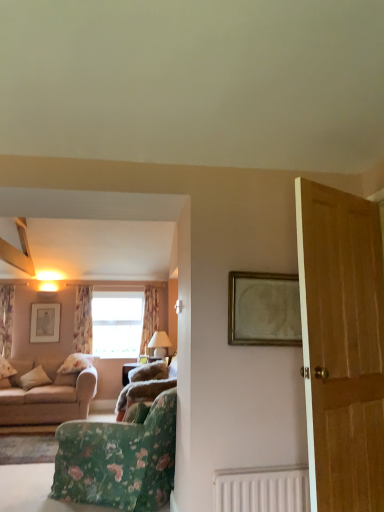
The image size is (384, 512). Describe the element at coordinates (159, 344) in the screenshot. I see `matte white lampshade at center` at that location.

Where is `beige fabric couch at left, which is the 1th studio couch in left-to-right order`? beige fabric couch at left, which is the 1th studio couch in left-to-right order is located at coordinates (50, 399).

This screenshot has height=512, width=384. Identify the location of fluffy beige couch at center, which is counted as the second studio couch, starting from the left. (146, 389).

This screenshot has height=512, width=384. What are the coordinates of `light brown wooden door at right` in the screenshot? It's located at (342, 346).

The height and width of the screenshot is (512, 384). I want to click on matte white lampshade at center, so click(159, 344).

Is matte white lampshade at center positioned far away from white matte radiator at lower center?

matte white lampshade at center is positioned a significant distance from white matte radiator at lower center.

From a real-world perspective, relative to white matte radiator at lower center, is matte white lampshade at center vertically above or below?

matte white lampshade at center is above white matte radiator at lower center.

Based on the photo, would you say matte white lampshade at center is inside or outside white matte radiator at lower center?

matte white lampshade at center cannot be found inside white matte radiator at lower center.

From the picture: Which of these two, matte white lampshade at center or white matte radiator at lower center, stands taller?

matte white lampshade at center is taller.

You are a GUI agent. You are given a task and a screenshot of the screen. Output one action in this format:
    pyautogui.click(x=<x>, y=<y>)
    Task: Click on the 2nd studio couch directly beneath the matte white lampshade at center (from a real-world perspective)
    
    Given the screenshot: What is the action you would take?
    coord(50,399)

Which object is thinner, beige fabric couch at left, which is the 1th studio couch in left-to-right order, or matte white lampshade at center?

Thinner between the two is matte white lampshade at center.

Considering the relative sizes of beige fabric couch at left, marked as the second studio couch in a right-to-left arrangement, and matte white lampshade at center in the image provided, is beige fabric couch at left, marked as the second studio couch in a right-to-left arrangement, taller than matte white lampshade at center?

Correct, beige fabric couch at left, marked as the second studio couch in a right-to-left arrangement, is much taller as matte white lampshade at center.

From the image's perspective, is beige fabric couch at left, which is the 1th studio couch in left-to-right order, located above or below matte white lampshade at center?

Based on their image positions, beige fabric couch at left, which is the 1th studio couch in left-to-right order, is located beneath matte white lampshade at center.

Which is closer, (156, 311) or (30, 417)?

Point (156, 311) appears to be farther away from the viewer than point (30, 417).

Does floral fabric curtain at center, the 1th curtain positioned from the right, have a smaller size compared to beige fabric couch at left, which is the 1th studio couch in left-to-right order?

Indeed, floral fabric curtain at center, the 1th curtain positioned from the right, has a smaller size compared to beige fabric couch at left, which is the 1th studio couch in left-to-right order.

Considering the sizes of floral fabric curtain at center, the 1th curtain positioned from the right, and beige fabric couch at left, marked as the second studio couch in a right-to-left arrangement, in the image, is floral fabric curtain at center, the 1th curtain positioned from the right, taller or shorter than beige fabric couch at left, marked as the second studio couch in a right-to-left arrangement,?

Clearly, floral fabric curtain at center, the 1th curtain positioned from the right, is taller compared to beige fabric couch at left, marked as the second studio couch in a right-to-left arrangement.

Is floral fabric curtain at center, the 1th curtain positioned from the right, positioned in front of beige fabric couch at left, which is the 1th studio couch in left-to-right order?

No, the depth of floral fabric curtain at center, the 1th curtain positioned from the right, is greater than that of beige fabric couch at left, which is the 1th studio couch in left-to-right order.

Which of these two, floral fabric curtain at left, the second curtain when ordered from left to right, or gold-toned wooden frame at upper center, arranged as the 1th picture frame when viewed from the front, is wider?

floral fabric curtain at left, the second curtain when ordered from left to right, is wider.

Which is more to the right, floral fabric curtain at left, positioned as the 2th curtain in right-to-left order, or gold-toned wooden frame at upper center, the 2th picture frame viewed from the back?

Positioned to the right is gold-toned wooden frame at upper center, the 2th picture frame viewed from the back.

From the image's perspective, between floral fabric curtain at left, positioned as the 2th curtain in right-to-left order, and gold-toned wooden frame at upper center, arranged as the 1th picture frame when viewed from the front, which one is located above?

gold-toned wooden frame at upper center, arranged as the 1th picture frame when viewed from the front.

From a real-world perspective, which object rests below the other?

From a 3D spatial view, gold-toned wooden frame at upper center, the 2th picture frame viewed from the back, is below.

Is floral fabric curtain at center, the 3th curtain viewed from the left, directly adjacent to matte white lampshade at center?

floral fabric curtain at center, the 3th curtain viewed from the left, and matte white lampshade at center are not in contact.

Considering the relative sizes of floral fabric curtain at center, the 3th curtain viewed from the left, and matte white lampshade at center in the image provided, is floral fabric curtain at center, the 3th curtain viewed from the left, shorter than matte white lampshade at center?

Incorrect, the height of floral fabric curtain at center, the 3th curtain viewed from the left, does not fall short of that of matte white lampshade at center.

How different are the orientations of floral fabric curtain at center, the 3th curtain viewed from the left, and matte white lampshade at center in degrees?

The angle between the facing direction of floral fabric curtain at center, the 3th curtain viewed from the left, and the facing direction of matte white lampshade at center is 91.5 degrees.

Which is behind, floral fabric curtain at center, the 1th curtain positioned from the right, or matte white lampshade at center?

floral fabric curtain at center, the 1th curtain positioned from the right, is further from the camera.

How many degrees apart are the facing directions of floral fabric chair at lower left and matte silver picture frame at upper left, placed as the second picture frame when sorted from right to left?

They differ by 0.11 degrees in their facing directions.

Could you tell me if floral fabric chair at lower left is facing matte silver picture frame at upper left, placed as the second picture frame when sorted from right to left?

No, floral fabric chair at lower left is not turned towards matte silver picture frame at upper left, placed as the second picture frame when sorted from right to left.

Who is taller, floral fabric chair at lower left or matte silver picture frame at upper left, placed as the second picture frame when sorted from right to left?

matte silver picture frame at upper left, placed as the second picture frame when sorted from right to left.

Is floral fabric chair at lower left at the left side of matte silver picture frame at upper left, placed as the 1th picture frame when sorted from left to right?

No, floral fabric chair at lower left is not to the left of matte silver picture frame at upper left, placed as the 1th picture frame when sorted from left to right.

Is floral fabric curtain at left, the second curtain when ordered from left to right, completely or partially inside floral fabric chair at lower left?

No.

Is floral fabric chair at lower left positioned far away from floral fabric curtain at left, the second curtain when ordered from left to right?

Yes, floral fabric chair at lower left is far from floral fabric curtain at left, the second curtain when ordered from left to right.

Considering the relative sizes of floral fabric chair at lower left and floral fabric curtain at left, positioned as the 2th curtain in right-to-left order, in the image provided, is floral fabric chair at lower left wider than floral fabric curtain at left, positioned as the 2th curtain in right-to-left order,?

Correct, the width of floral fabric chair at lower left exceeds that of floral fabric curtain at left, positioned as the 2th curtain in right-to-left order.

Is floral fabric chair at lower left at the right side of floral fabric curtain at left, positioned as the 2th curtain in right-to-left order?

Indeed, floral fabric chair at lower left is positioned on the right side of floral fabric curtain at left, positioned as the 2th curtain in right-to-left order.

Locate an element on the screen. The height and width of the screenshot is (512, 384). lamp behind the white matte radiator at lower center is located at coordinates (159, 344).

Where is `the 2nd studio couch in front of the matte white lampshade at center`? the 2nd studio couch in front of the matte white lampshade at center is located at coordinates (50, 399).

Considering their positions, is white matte radiator at lower center positioned further to light brown wooden door at right than floral fabric curtain at left, positioned as the 2th curtain in right-to-left order?

floral fabric curtain at left, positioned as the 2th curtain in right-to-left order, is positioned further to the anchor light brown wooden door at right.

When comparing their distances from fluffy beige couch at center, the first studio couch positioned from the right, does beige fabric couch at left, marked as the second studio couch in a right-to-left arrangement, or floral fabric curtain at left, marked as the third curtain in a right-to-left arrangement, seem further?

The object further to fluffy beige couch at center, the first studio couch positioned from the right, is floral fabric curtain at left, marked as the third curtain in a right-to-left arrangement.

From the image, which object appears to be farther from fluffy beige couch at center, which is counted as the second studio couch, starting from the left, floral fabric curtain at left, marked as the third curtain in a right-to-left arrangement, or matte white lampshade at center?

floral fabric curtain at left, marked as the third curtain in a right-to-left arrangement.

From the image, which object appears to be farther from floral fabric curtain at left, marked as the third curtain in a right-to-left arrangement, floral fabric chair at lower left or matte white lampshade at center?

floral fabric chair at lower left is positioned further to the anchor floral fabric curtain at left, marked as the third curtain in a right-to-left arrangement.

Estimate the real-world distances between objects in this image. Which object is closer to beige fabric couch at left, marked as the second studio couch in a right-to-left arrangement, floral fabric curtain at center, the 3th curtain viewed from the left, or white matte radiator at lower center?

The object closer to beige fabric couch at left, marked as the second studio couch in a right-to-left arrangement, is floral fabric curtain at center, the 3th curtain viewed from the left.

Which object lies nearer to the anchor point fluffy beige couch at center, which is counted as the second studio couch, starting from the left, floral fabric curtain at center, the 1th curtain positioned from the right, or white matte radiator at lower center?

white matte radiator at lower center is positioned closer to the anchor fluffy beige couch at center, which is counted as the second studio couch, starting from the left.

Estimate the real-world distances between objects in this image. Which object is further from matte white lampshade at center, white matte radiator at lower center or fluffy beige couch at center, the first studio couch positioned from the right?

The object further to matte white lampshade at center is white matte radiator at lower center.

Looking at the image, which one is located closer to floral fabric curtain at left, the second curtain when ordered from left to right, floral fabric curtain at center, the 1th curtain positioned from the right, or beige fabric couch at left, marked as the second studio couch in a right-to-left arrangement?

floral fabric curtain at center, the 1th curtain positioned from the right.

The image size is (384, 512). What are the coordinates of `picture frame positioned between white matte radiator at lower center and beige fabric couch at left, which is the 1th studio couch in left-to-right order, from near to far` in the screenshot? It's located at (264, 309).

Locate an element on the screen. chair between white matte radiator at lower center and matte silver picture frame at upper left, placed as the second picture frame when sorted from right to left, in the front-back direction is located at coordinates (119, 460).

What are the coordinates of `studio couch between floral fabric chair at lower left and fluffy beige couch at center, which is counted as the second studio couch, starting from the left, from front to back` in the screenshot? It's located at (50, 399).

This screenshot has height=512, width=384. Find the location of `picture frame between floral fabric chair at lower left and matte silver picture frame at upper left, placed as the second picture frame when sorted from right to left, in the front-back direction`. picture frame between floral fabric chair at lower left and matte silver picture frame at upper left, placed as the second picture frame when sorted from right to left, in the front-back direction is located at coordinates (264, 309).